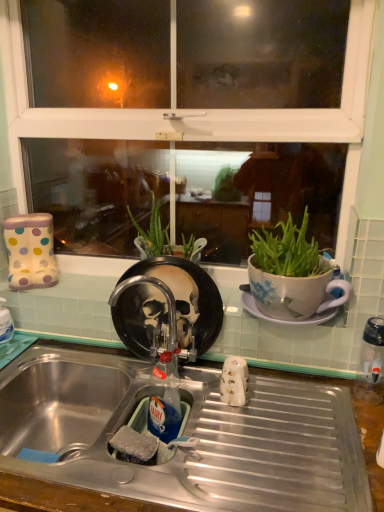
This screenshot has width=384, height=512. Find the location of `vacant area that lies in front of clear plastic water bottle at right`. vacant area that lies in front of clear plastic water bottle at right is located at coordinates (355, 432).